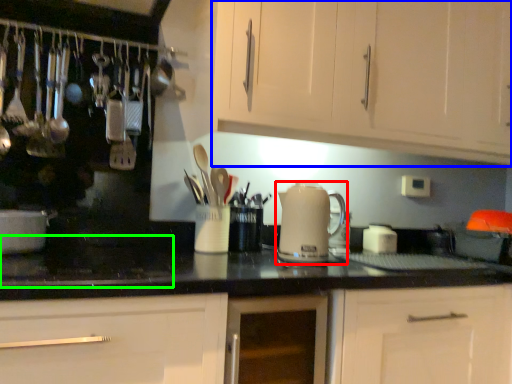
Question: Which object is positioned closest to kitchen appliance (highlighted by a red box)? Select from cabinetry (highlighted by a blue box) and gas stove (highlighted by a green box).

Choices:
 (A) cabinetry
 (B) gas stove

Answer: (A)